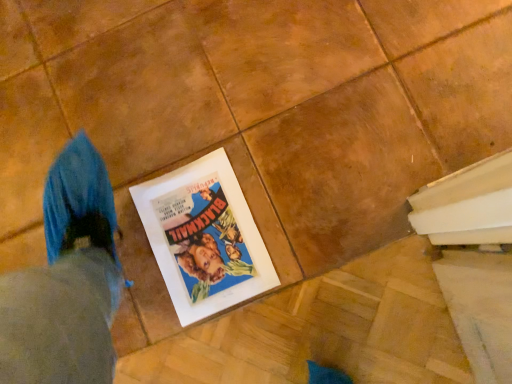
The width and height of the screenshot is (512, 384). In order to click on matte paper comic book at center in this screenshot , I will do `click(204, 237)`.

Describe the element at coordinates (204, 237) in the screenshot. I see `matte paper comic book at center` at that location.

The width and height of the screenshot is (512, 384). Identify the location of matte paper comic book at center. (204, 237).